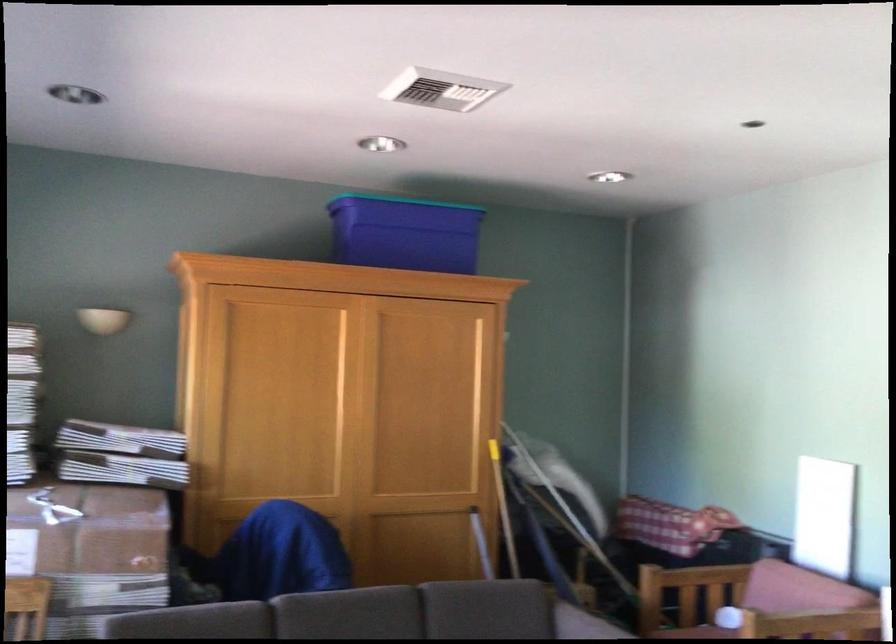
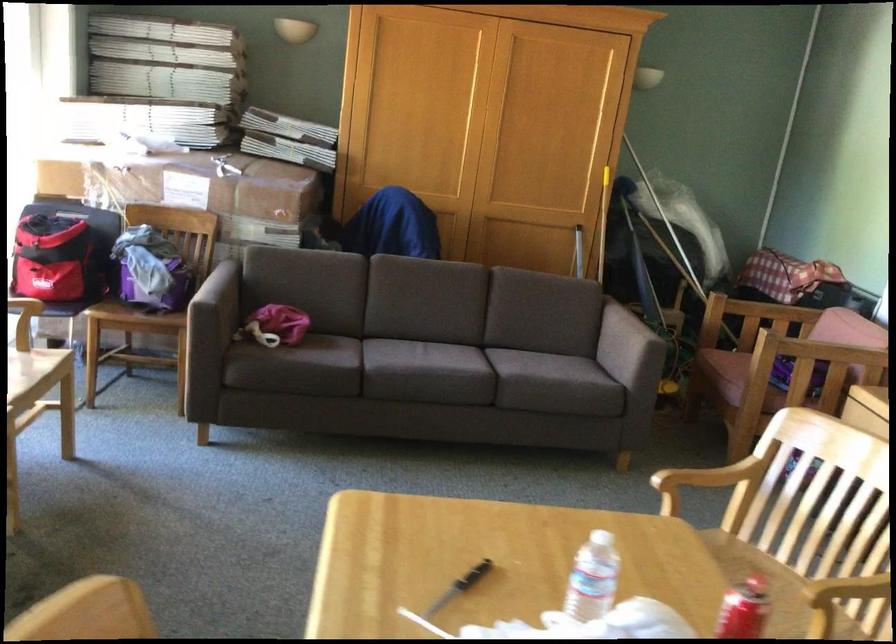
What movement of the cameraman would produce the second image?

The movement direction of the cameraman is right, backward.